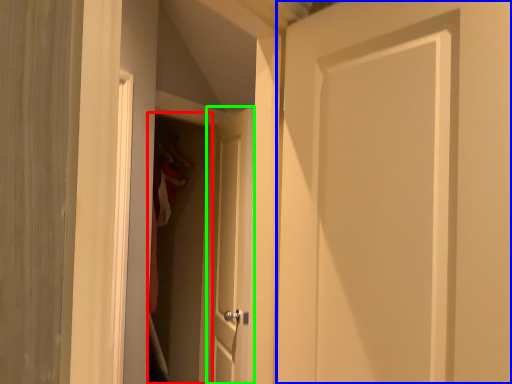
Question: Which object is the farthest from screen door (highlighted by a red box)? Choose among these: door (highlighted by a blue box) or door (highlighted by a green box).

Choices:
 (A) door
 (B) door

Answer: (A)